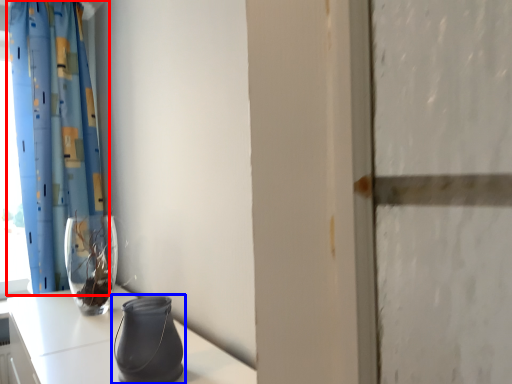
Question: Which of the following is the farthest to the observer, curtain (highlighted by a red box) or vase (highlighted by a blue box)?

Choices:
 (A) curtain
 (B) vase

Answer: (A)